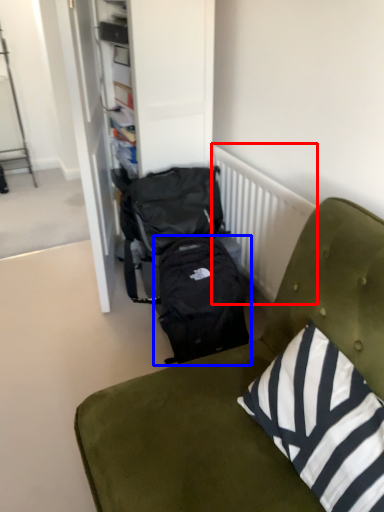
Question: Which of the following is the farthest to the observer, radiator (highlighted by a red box) or backpack (highlighted by a blue box)?

Choices:
 (A) radiator
 (B) backpack

Answer: (B)